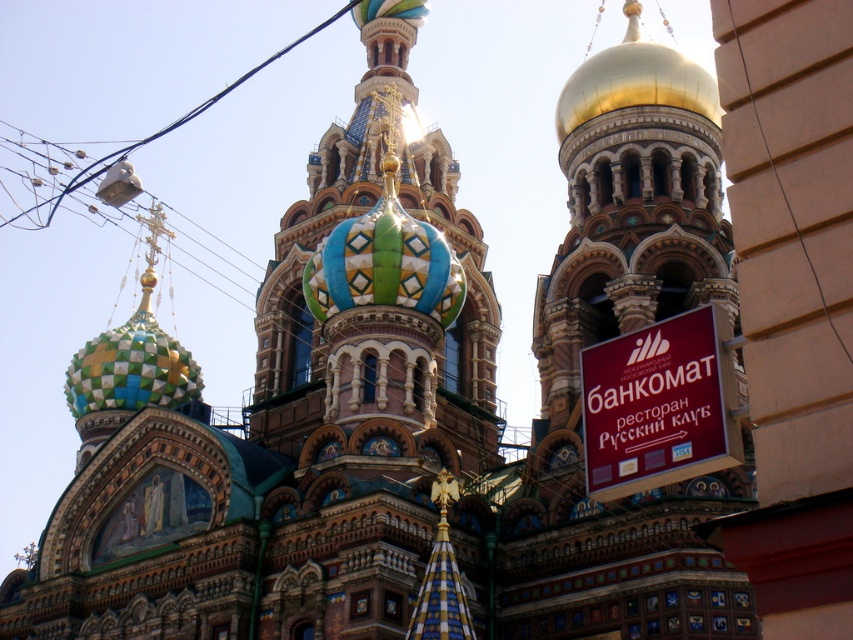
Question: Which of the following is the farthest from the observer?

Choices:
 (A) (723, 376)
 (B) (761, 140)

Answer: (A)

Question: Considering the relative positions of maroon wooden sign at right and black wire at right in the image provided, where is maroon wooden sign at right located with respect to black wire at right?

Choices:
 (A) left
 (B) right

Answer: (A)

Question: Which point is closer to the camera?

Choices:
 (A) maroon wooden sign at right
 (B) black wire at right

Answer: (B)

Question: Which object is closer to the camera taking this photo?

Choices:
 (A) maroon wooden sign at right
 (B) white plastic bag at upper left
 (C) black wire at right

Answer: (C)

Question: Observing the image, what is the correct spatial positioning of maroon wooden sign at right in reference to white plastic bag at upper left?

Choices:
 (A) left
 (B) right

Answer: (B)

Question: Does maroon wooden sign at right come in front of white plastic bag at upper left?

Choices:
 (A) no
 (B) yes

Answer: (B)